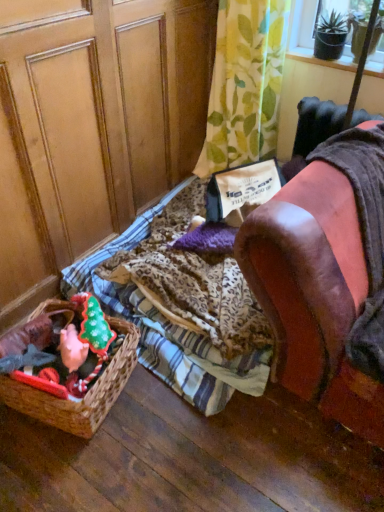
Question: Considering the relative positions of green leafy fabric at upper center and brown woven basket at lower left in the image provided, is green leafy fabric at upper center to the right of brown woven basket at lower left from the viewer's perspective?

Choices:
 (A) yes
 (B) no

Answer: (A)

Question: Does green leafy fabric at upper center have a lesser width compared to brown woven basket at lower left?

Choices:
 (A) no
 (B) yes

Answer: (B)

Question: From the image's perspective, would you say green leafy fabric at upper center is positioned over brown woven basket at lower left?

Choices:
 (A) yes
 (B) no

Answer: (A)

Question: From the image's perspective, would you say green leafy fabric at upper center is shown under brown woven basket at lower left?

Choices:
 (A) yes
 (B) no

Answer: (B)

Question: Is green leafy fabric at upper center oriented towards brown woven basket at lower left?

Choices:
 (A) yes
 (B) no

Answer: (A)

Question: Considering the positions of brown woven basket at lower left and green leafy fabric at upper center in the image, is brown woven basket at lower left wider or thinner than green leafy fabric at upper center?

Choices:
 (A) thin
 (B) wide

Answer: (B)

Question: Looking at the image, does brown woven basket at lower left seem bigger or smaller compared to green leafy fabric at upper center?

Choices:
 (A) big
 (B) small

Answer: (B)

Question: In terms of height, does brown woven basket at lower left look taller or shorter compared to green leafy fabric at upper center?

Choices:
 (A) tall
 (B) short

Answer: (B)

Question: Does point (94, 428) appear closer or farther from the camera than point (264, 22)?

Choices:
 (A) closer
 (B) farther

Answer: (A)

Question: Is wooden screen door at left to the left or to the right of transparent plastic screen at upper right in the image?

Choices:
 (A) right
 (B) left

Answer: (B)

Question: From a real-world perspective, is wooden screen door at left positioned above or below transparent plastic screen at upper right?

Choices:
 (A) above
 (B) below

Answer: (B)

Question: Do you think wooden screen door at left is within transparent plastic screen at upper right, or outside of it?

Choices:
 (A) outside
 (B) inside

Answer: (A)

Question: From the image's perspective, is wooden screen door at left above or below transparent plastic screen at upper right?

Choices:
 (A) below
 (B) above

Answer: (A)

Question: From their relative heights in the image, would you say leather armchair at right is taller or shorter than brown woven basket at lower left?

Choices:
 (A) tall
 (B) short

Answer: (A)

Question: Considering the positions of point (339, 348) and point (76, 401), is point (339, 348) closer or farther from the camera than point (76, 401)?

Choices:
 (A) farther
 (B) closer

Answer: (B)